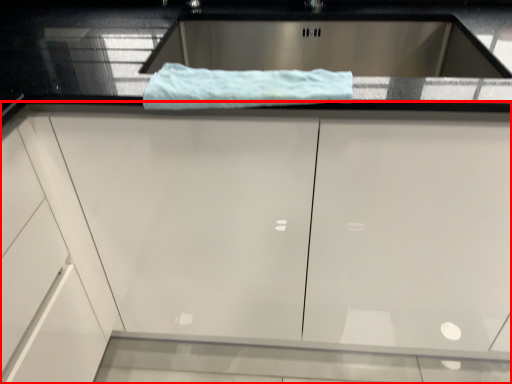
Question: Considering the relative positions of cabinetry (annotated by the red box) and bath towel in the image provided, where is cabinetry (annotated by the red box) located with respect to the staircase?

Choices:
 (A) left
 (B) right

Answer: (B)